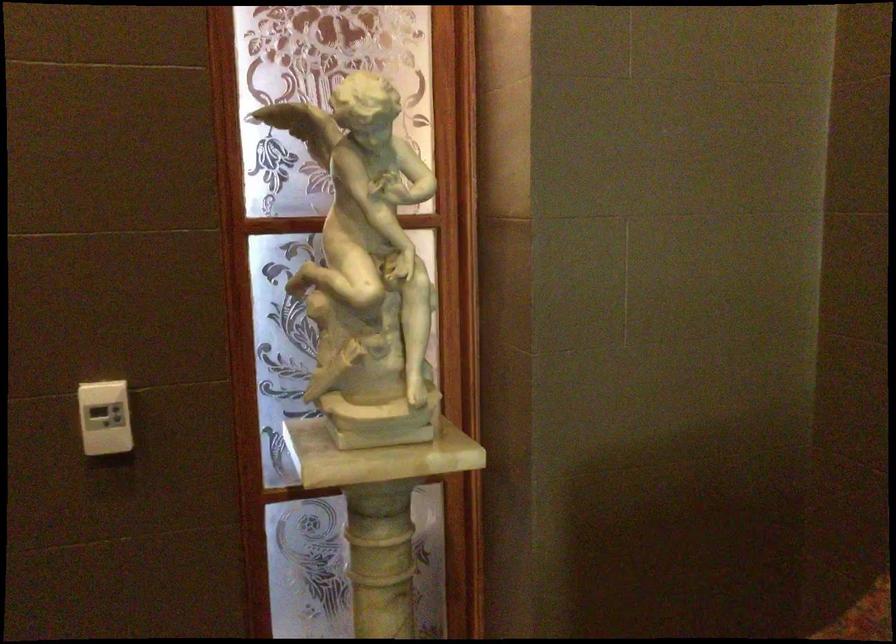
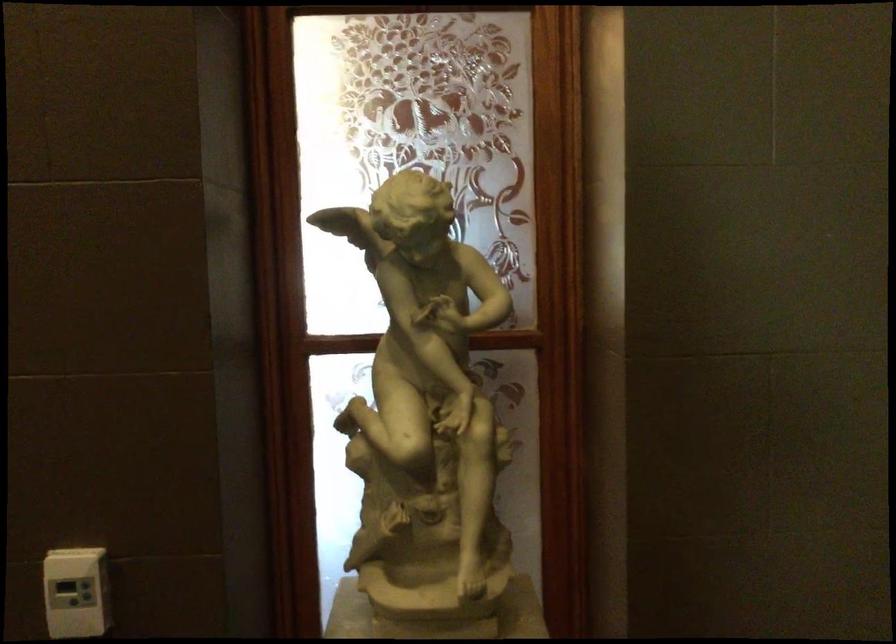
The images are taken continuously from a first-person perspective. In which direction are you moving?

The cameraman walked toward right, forward.